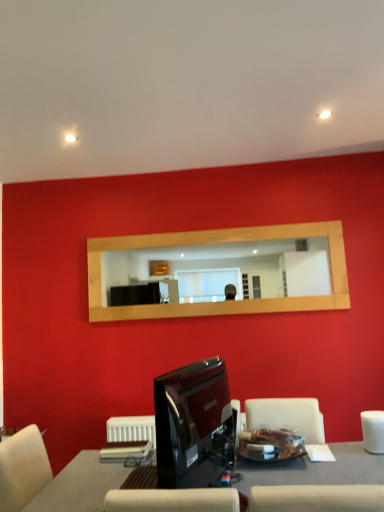
This screenshot has height=512, width=384. Describe the element at coordinates (193, 425) in the screenshot. I see `glossy black monitor at lower center` at that location.

What do you see at coordinates (225, 269) in the screenshot?
I see `wooden mirror at center` at bounding box center [225, 269].

In order to click on glossy black monitor at lower center in this screenshot , I will do `click(193, 425)`.

Is smooth gray table at center not close to wooden mirror at center?

Indeed, smooth gray table at center is not near wooden mirror at center.

Is smooth gray table at center not within wooden mirror at center?

That's correct, smooth gray table at center is outside of wooden mirror at center.

Is smooth gray table at center facing towards wooden mirror at center?

No, smooth gray table at center is not aimed at wooden mirror at center.

Is smooth gray table at center taller than wooden mirror at center?

In fact, smooth gray table at center may be shorter than wooden mirror at center.

Is glossy black monitor at lower center located outside smooth gray table at center?

Absolutely, glossy black monitor at lower center is external to smooth gray table at center.

From the image's perspective, which one is positioned lower, glossy black monitor at lower center or smooth gray table at center?

smooth gray table at center is shown below in the image.

Considering the sizes of objects glossy black monitor at lower center and smooth gray table at center in the image provided, who is wider, glossy black monitor at lower center or smooth gray table at center?

With larger width is smooth gray table at center.

Is glossy black monitor at lower center facing towards smooth gray table at center?

No, glossy black monitor at lower center does not turn towards smooth gray table at center.

Is white matte armchair at lower right to the right of smooth gray table at center from the viewer's perspective?

Indeed, white matte armchair at lower right is positioned on the right side of smooth gray table at center.

You are a GUI agent. You are given a task and a screenshot of the screen. Output one action in this format:
    pyautogui.click(x=<x>, y=<y>)
    Task: Click on the armchair on the right of smooth gray table at center
    This screenshot has width=384, height=512.
    Given the screenshot: What is the action you would take?
    pyautogui.click(x=373, y=431)

From the image's perspective, which object appears higher, white matte armchair at lower right or smooth gray table at center?

From the image's view, white matte armchair at lower right is above.

From a real-world perspective, is white matte armchair at lower right physically below smooth gray table at center?

No, from a real-world perspective, white matte armchair at lower right is not under smooth gray table at center.

Is wooden mirror at center surrounded by white matte armchair at lower right?

No, wooden mirror at center is not a part of white matte armchair at lower right.

Looking at their sizes, would you say white matte armchair at lower right is wider or thinner than wooden mirror at center?

white matte armchair at lower right is wider than wooden mirror at center.

Find the location of a particular element. The width and height of the screenshot is (384, 512). mirror positioned vertically above the white matte armchair at lower right (from a real-world perspective) is located at coordinates (225, 269).

Considering the positions of points (362, 425) and (138, 277), is point (362, 425) closer to camera compared to point (138, 277)?

That is True.

From a real-world perspective, who is located higher, glossy black monitor at lower center or wooden mirror at center?

In real-world perspective, wooden mirror at center is above.

Consider the image. Between glossy black monitor at lower center and wooden mirror at center, which one has larger width?

With larger width is glossy black monitor at lower center.

Is point (217, 407) farther from camera compared to point (286, 278)?

No, (217, 407) is closer to viewer.

Are wooden mirror at center and smooth gray table at center located far from each other?

Yes, wooden mirror at center is far from smooth gray table at center.

Which is further, (194, 249) or (352, 497)?

Positioned behind is point (194, 249).

In the scene shown: From a real-world perspective, which object rests below the other?

In real-world perspective, smooth gray table at center is lower.

Based on the photo, is wooden mirror at center to the left of smooth gray table at center from the viewer's perspective?

No.

In the image, is smooth gray table at center positioned in front of or behind glossy black monitor at lower center?

Visually, smooth gray table at center is located behind glossy black monitor at lower center.

From their relative heights in the image, would you say smooth gray table at center is taller or shorter than glossy black monitor at lower center?

smooth gray table at center is shorter than glossy black monitor at lower center.

Is smooth gray table at center next to glossy black monitor at lower center?

They are not placed beside each other.

The image size is (384, 512). In order to click on mirror located above the smooth gray table at center (from the image's perspective) in this screenshot , I will do `click(225, 269)`.

Find the location of `computer monitor on the left of smooth gray table at center`. computer monitor on the left of smooth gray table at center is located at coordinates [193, 425].

From the image, which object appears to be farther from white matte armchair at lower right, smooth gray table at center or wooden mirror at center?

wooden mirror at center is further to white matte armchair at lower right.

From the picture: Considering their positions, is white matte armchair at lower right positioned further to smooth gray table at center than wooden mirror at center?

The object further to smooth gray table at center is wooden mirror at center.

Based on their spatial positions, is glossy black monitor at lower center or smooth gray table at center further from white matte armchair at lower right?

glossy black monitor at lower center lies further to white matte armchair at lower right than the other object.

Which object lies further to the anchor point white matte armchair at lower right, smooth gray table at center or glossy black monitor at lower center?

glossy black monitor at lower center is positioned further to the anchor white matte armchair at lower right.

Estimate the real-world distances between objects in this image. Which object is further from wooden mirror at center, white matte armchair at lower right or smooth gray table at center?

Based on the image, smooth gray table at center appears to be further to wooden mirror at center.

Looking at the image, which one is located closer to glossy black monitor at lower center, white matte armchair at lower right or wooden mirror at center?

white matte armchair at lower right is closer to glossy black monitor at lower center.

Based on their spatial positions, is smooth gray table at center or wooden mirror at center closer to glossy black monitor at lower center?

smooth gray table at center is closer to glossy black monitor at lower center.

From the picture: When comparing their distances from glossy black monitor at lower center, does white matte armchair at lower right or smooth gray table at center seem closer?

Among the two, smooth gray table at center is located nearer to glossy black monitor at lower center.

This screenshot has width=384, height=512. Identify the location of table between glossy black monitor at lower center and wooden mirror at center in the front-back direction. (320, 483).

You are a GUI agent. You are given a task and a screenshot of the screen. Output one action in this format:
    pyautogui.click(x=<x>, y=<y>)
    Task: Click on the armchair between glossy black monitor at lower center and wooden mirror at center from front to back
    
    Given the screenshot: What is the action you would take?
    pyautogui.click(x=373, y=431)

The width and height of the screenshot is (384, 512). What are the coordinates of `armchair positioned between smooth gray table at center and wooden mirror at center from near to far` in the screenshot? It's located at (373, 431).

Where is `table situated between glossy black monitor at lower center and white matte armchair at lower right from left to right`? table situated between glossy black monitor at lower center and white matte armchair at lower right from left to right is located at coordinates pos(320,483).